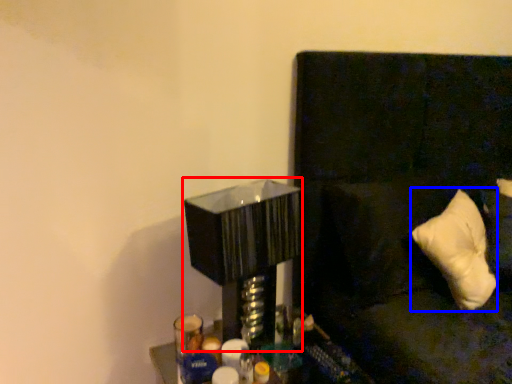
Question: Which point is further to the camera, table lamp (highlighted by a red box) or pillow (highlighted by a blue box)?

Choices:
 (A) table lamp
 (B) pillow

Answer: (B)